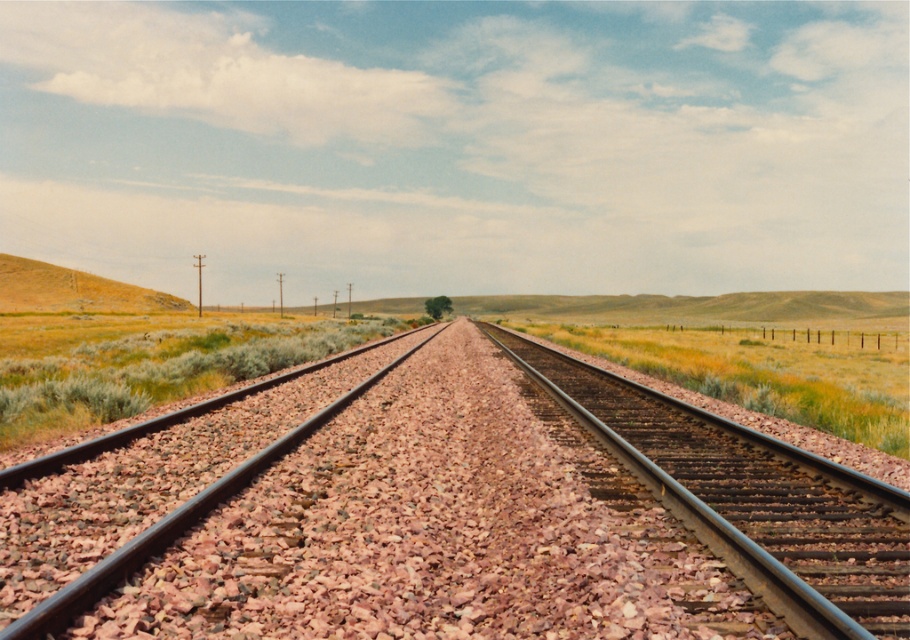
Who is positioned more to the left, metal/smooth train tracks at center or metal/smooth train track at center?

metal/smooth train tracks at center

Between point (466, 570) and point (871, 600), which one is positioned behind?

Positioned behind is point (466, 570).

Is point (514, 378) positioned before point (719, 467)?

No, it is not.

Where is `metal/smooth train tracks at center`? The image size is (910, 640). metal/smooth train tracks at center is located at coordinates (516, 522).